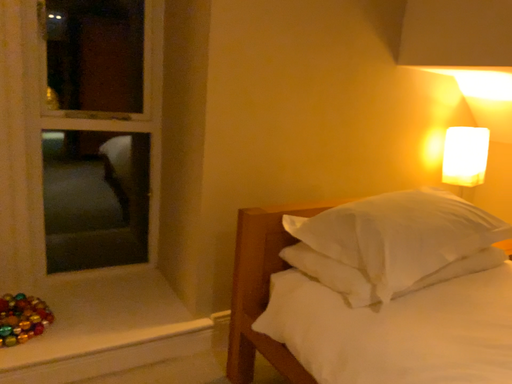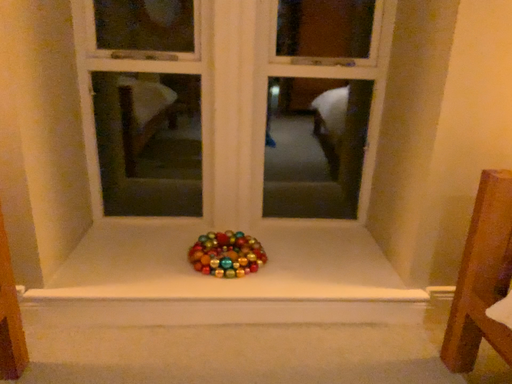
Question: How did the camera likely rotate when shooting the video?

Choices:
 (A) rotated left
 (B) rotated right

Answer: (A)